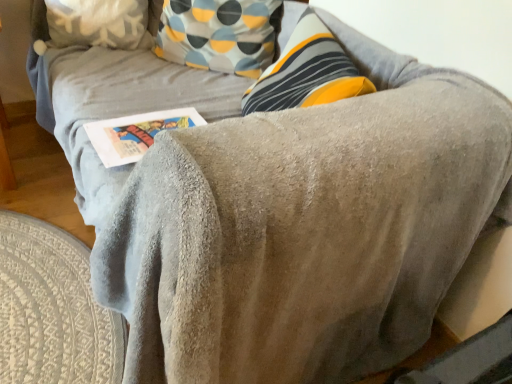
Locate an element on the screen. fluffy white pillow at upper left is located at coordinates (90, 24).

What do you see at coordinates (90, 24) in the screenshot? I see `fluffy white pillow at upper left` at bounding box center [90, 24].

Locate an element on the screen. This screenshot has height=384, width=512. white paper at center is located at coordinates (136, 133).

Image resolution: width=512 pixels, height=384 pixels. Describe the element at coordinates (136, 133) in the screenshot. I see `white paper at center` at that location.

Identify the location of fluffy white pillow at upper left. (90, 24).

Considering the positions of objects white paper at center and fluffy white pillow at upper left in the image provided, who is more to the right, white paper at center or fluffy white pillow at upper left?

Positioned to the right is white paper at center.

Which object is further away from the camera taking this photo, white paper at center or fluffy white pillow at upper left?

fluffy white pillow at upper left is more distant.

Considering the points (96, 146) and (52, 23), which point is in front, point (96, 146) or point (52, 23)?

The point (96, 146) is in front.

From the image's perspective, does white paper at center appear lower than fluffy white pillow at upper left?

Yes, from the image's perspective, white paper at center is below fluffy white pillow at upper left.

From a real-world perspective, is white paper at center positioned over fluffy white pillow at upper left based on gravity?

Actually, white paper at center is physically below fluffy white pillow at upper left in the real world.

Does white paper at center have a greater width compared to fluffy white pillow at upper left?

Yes.

Can you confirm if white paper at center is shorter than fluffy white pillow at upper left?

Indeed, white paper at center has a lesser height compared to fluffy white pillow at upper left.

Between white paper at center and fluffy white pillow at upper left, which one has larger size?

fluffy white pillow at upper left.

Is fluffy white pillow at upper left located within white paper at center?

No, fluffy white pillow at upper left is located outside of white paper at center.

Is white paper at center far from fluffy white pillow at upper left?

→ That's not correct — white paper at center is a little close to fluffy white pillow at upper left.

Is white paper at center oriented away from fluffy white pillow at upper left?

white paper at center is not turned away from fluffy white pillow at upper left.

How different are the orientations of white paper at center and fluffy white pillow at upper left in degrees?

65.6 degrees.

Where is `pillow above the white paper at center (from a real-world perspective)`? The image size is (512, 384). pillow above the white paper at center (from a real-world perspective) is located at coordinates (90, 24).

Which is more to the left, fluffy white pillow at upper left or white paper at center?

Positioned to the left is fluffy white pillow at upper left.

In the image, is fluffy white pillow at upper left positioned in front of or behind white paper at center?

fluffy white pillow at upper left is behind white paper at center.

Is point (108, 29) less distant than point (111, 160)?

No.

From the image's perspective, is fluffy white pillow at upper left positioned above or below white paper at center?

Clearly, from the image's perspective, fluffy white pillow at upper left is above white paper at center.

From a real-world perspective, relative to white paper at center, is fluffy white pillow at upper left vertically above or below?

Clearly, from a real-world perspective, fluffy white pillow at upper left is above white paper at center.

Between fluffy white pillow at upper left and white paper at center, which one has smaller width?

Thinner between the two is fluffy white pillow at upper left.

Who is shorter, fluffy white pillow at upper left or white paper at center?

white paper at center.

Which of these two, fluffy white pillow at upper left or white paper at center, is bigger?

fluffy white pillow at upper left.

Is fluffy white pillow at upper left completely or partially outside of white paper at center?

Yes, fluffy white pillow at upper left is outside of white paper at center.

Is fluffy white pillow at upper left next to white paper at center and touching it?

fluffy white pillow at upper left and white paper at center are not in contact.

Could you tell me if fluffy white pillow at upper left is facing white paper at center?

Yes, fluffy white pillow at upper left is turned towards white paper at center.

Locate an element on the screen. This screenshot has height=384, width=512. pillow that is above the white paper at center (from a real-world perspective) is located at coordinates (90, 24).

At what (x,y) coordinates should I click in order to perform the action: click on paperback book located on the right of fluffy white pillow at upper left. Please return your answer as a coordinate pair (x, y). Looking at the image, I should click on (136, 133).

Locate an element on the screen. The height and width of the screenshot is (384, 512). paperback book that is below the fluffy white pillow at upper left (from the image's perspective) is located at coordinates (136, 133).